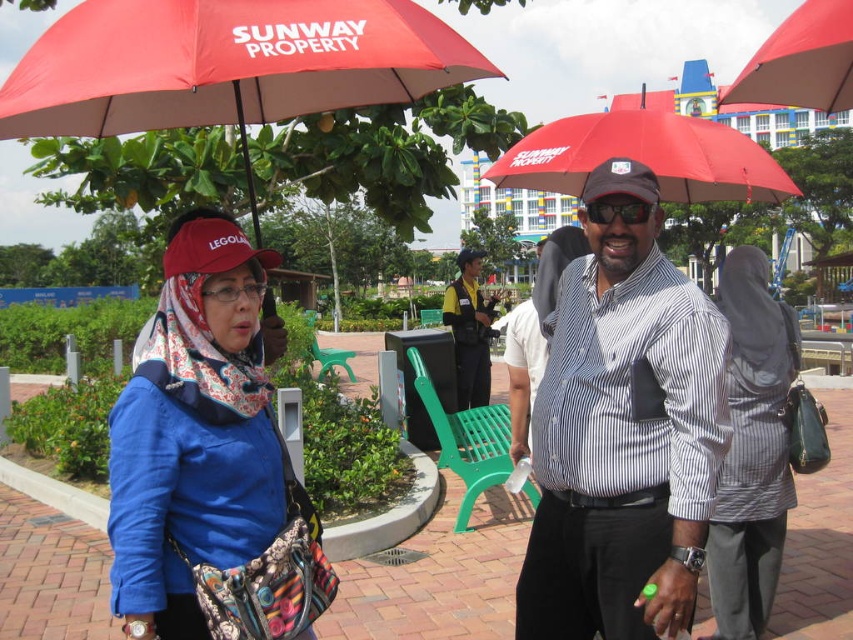
You are a photographer at the park and want to capture both the red matte umbrella at upper left and the red matte umbrella at upper center in a single frame. Which umbrella should you position on the left side of your camera frame to include both?

You should position the red matte umbrella at upper left on the left side of your camera frame because it is already on the left side of the red matte umbrella at upper center, ensuring both can be captured together.